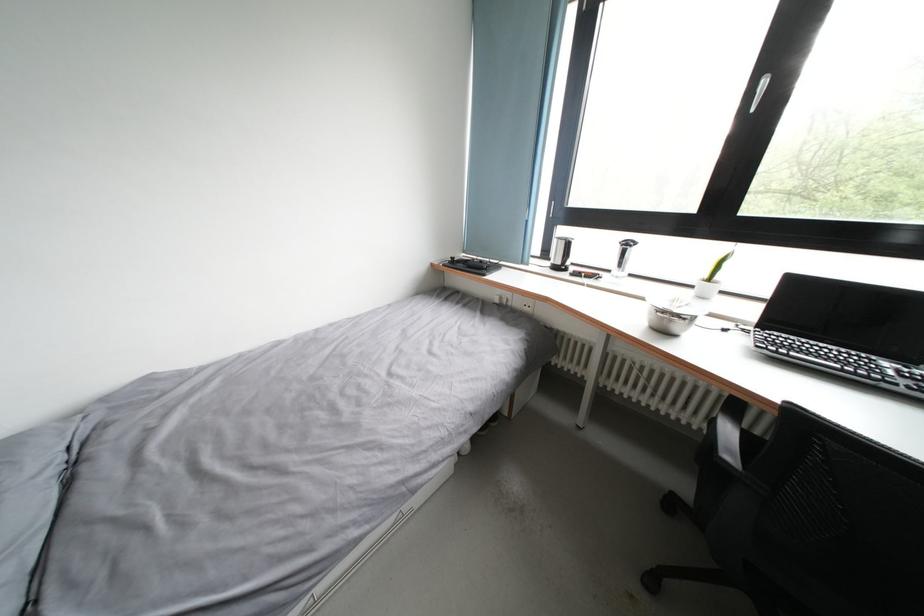
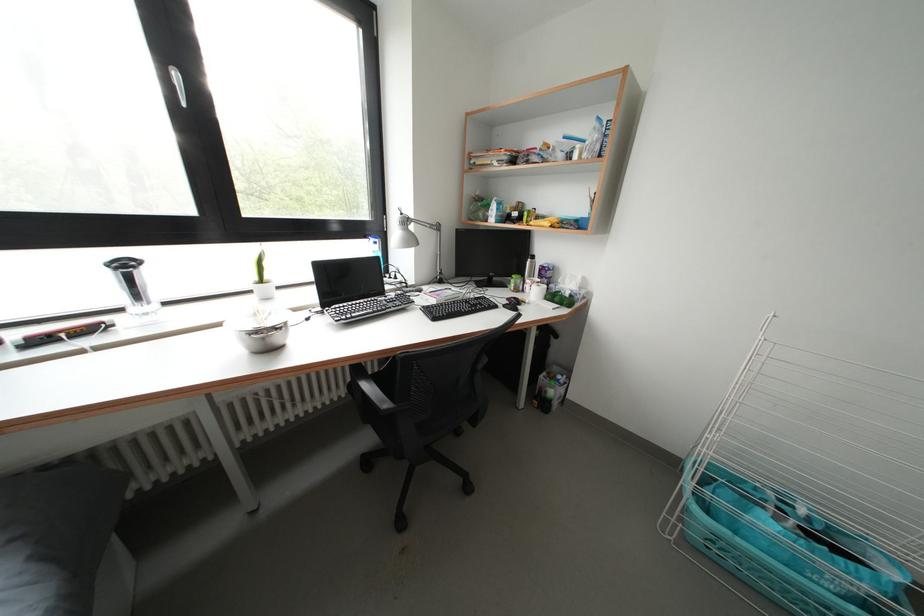
In the scene shown: The images are taken continuously from a first-person perspective. In which direction is your viewpoint rotating?

The camera rotated toward right-down.